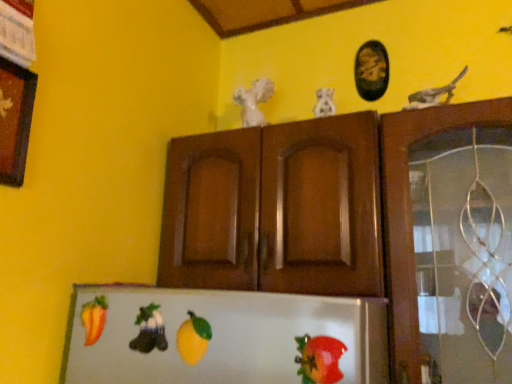
Question: Is shiny plastic tomato at lower right taller or shorter than wooden picture frame at upper left, marked as the first picture frame in a front-to-back arrangement?

Choices:
 (A) tall
 (B) short

Answer: (B)

Question: From the image's perspective, is shiny plastic tomato at lower right positioned above or below wooden picture frame at upper left, the second picture frame from the back?

Choices:
 (A) above
 (B) below

Answer: (B)

Question: Based on their relative distances, which object is farther from the black oval frame at upper center, placed as the 1th picture frame when sorted from top to bottom?

Choices:
 (A) smooth orange carrot at lower left, which is the 1th fruit in back-to-front order
 (B) wooden picture frame at upper left, marked as the first picture frame in a front-to-back arrangement
 (C) white glossy statue at upper center, which ranks as the second animal in front-to-back order
 (D) white matte sculpture at center, which is counted as the first animal, starting from the top
 (E) yellow matte lemon at center, the 2th fruit positioned from the back

Answer: (A)

Question: Which object is positioned closest to the green felt boot at lower center, which is the third animal in right-to-left order?

Choices:
 (A) yellow matte lemon at center, marked as the 1th fruit in a front-to-back arrangement
 (B) black oval frame at upper center, which ranks as the first picture frame in right-to-left order
 (C) white glossy statue at upper center, the 3th animal from the left
 (D) smooth orange carrot at lower left, the second fruit viewed from the right
 (E) wooden picture frame at upper left, positioned as the 1th picture frame in left-to-right order

Answer: (A)